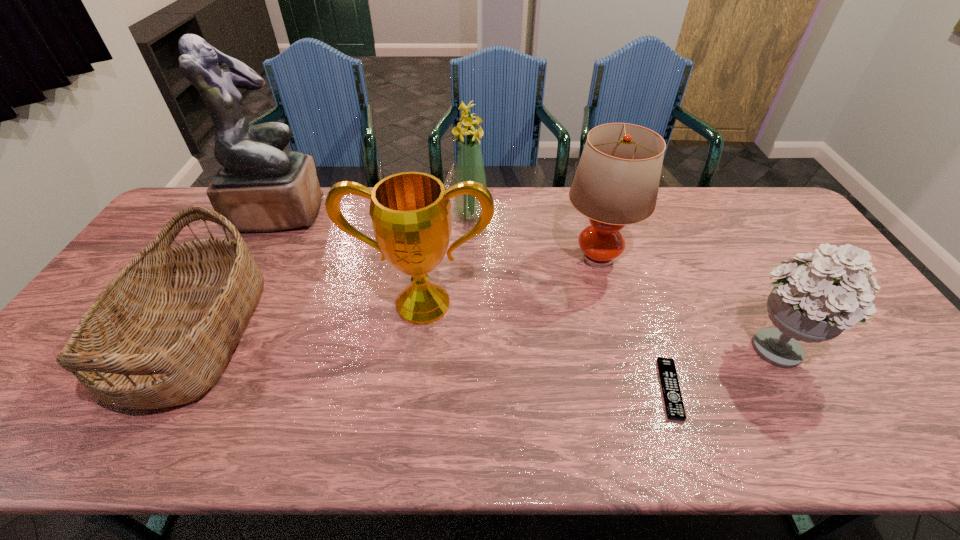
This screenshot has height=540, width=960. I want to click on the tallest object, so tap(259, 188).

In order to click on lamp in this screenshot , I will do `click(616, 183)`.

The image size is (960, 540). I want to click on the taller bouquet, so click(x=469, y=165).

You are a GUI agent. You are given a task and a screenshot of the screen. Output one action in this format:
    pyautogui.click(x=<x>, y=<y>)
    Task: Click on the farther bouquet
    This screenshot has width=960, height=540.
    Given the screenshot: What is the action you would take?
    pyautogui.click(x=469, y=165)

Where is `award`? award is located at coordinates (410, 211).

Where is `the right bouquet`? The width and height of the screenshot is (960, 540). the right bouquet is located at coordinates (808, 304).

Identify the location of the third shortest object. (808, 304).

Locate an element on the screen. the sixth tallest object is located at coordinates (160, 334).

The image size is (960, 540). I want to click on the shortest object, so click(x=673, y=400).

The height and width of the screenshot is (540, 960). What are the coordinates of `vacant region located in a relaxed pose on the tallest object` in the screenshot? It's located at (420, 212).